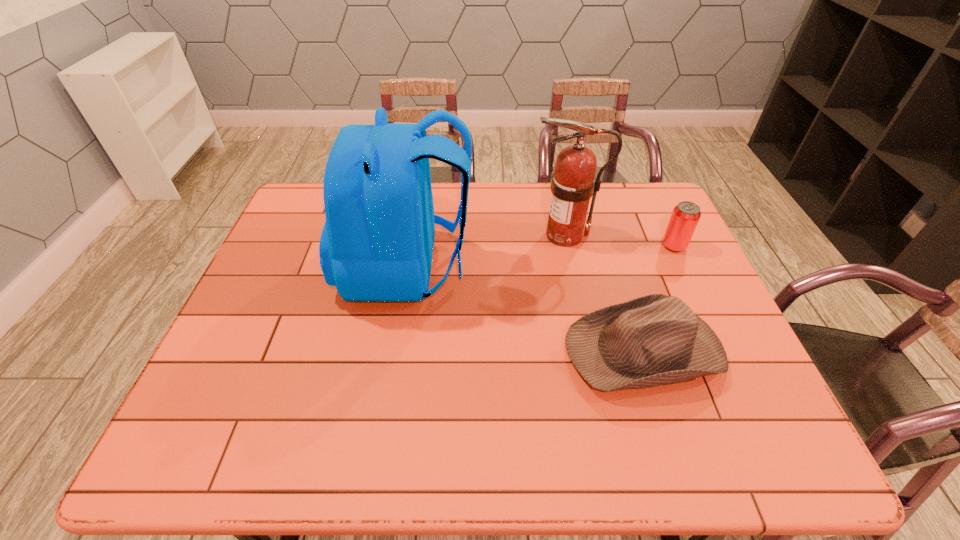
Where is `object located at the far edge`? object located at the far edge is located at coordinates (572, 185).

This screenshot has width=960, height=540. What are the coordinates of `can present at the right edge` in the screenshot? It's located at (685, 216).

I want to click on fedora situated at the right edge, so click(654, 340).

In the image, there is a desktop. Where is `vacant region at the far edge`? This screenshot has height=540, width=960. vacant region at the far edge is located at coordinates (505, 200).

Identify the location of free region at the near edge. (584, 463).

In the image, there is a desktop. Where is `vacant space at the left edge`? The width and height of the screenshot is (960, 540). vacant space at the left edge is located at coordinates (233, 325).

This screenshot has width=960, height=540. What are the coordinates of `free space at the right edge of the desktop` in the screenshot? It's located at (664, 285).

Locate an element on the screen. Image resolution: width=960 pixels, height=540 pixels. vacant space at the far right corner of the desktop is located at coordinates (666, 219).

Identify the location of vacant area at the near right corner of the desktop. Image resolution: width=960 pixels, height=540 pixels. tap(779, 436).

Locate an element on the screen. The height and width of the screenshot is (540, 960). free space that is in between the fire extinguisher and the fedora is located at coordinates (604, 292).